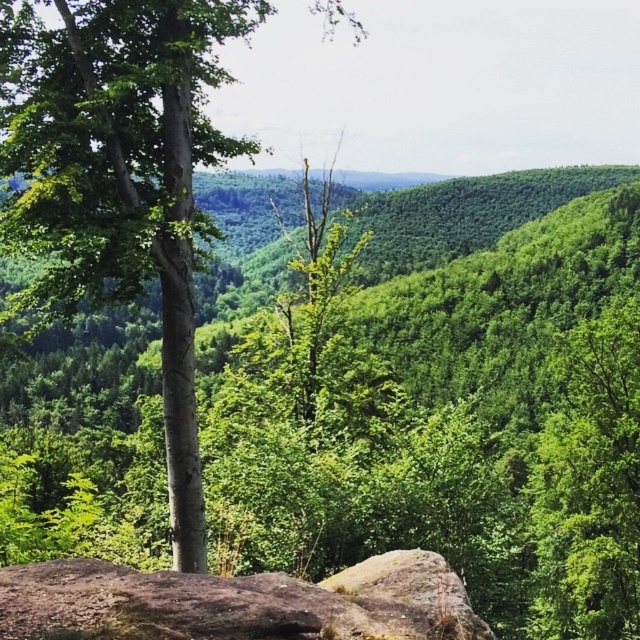
Can you confirm if green matte tree at center is positioned below brown rough rock at lower center?

No.

Which of these two, green matte tree at center or brown rough rock at lower center, stands shorter?

Standing shorter between the two is brown rough rock at lower center.

Which is behind, point (189, 426) or point (72, 605)?

Positioned behind is point (189, 426).

This screenshot has width=640, height=640. What are the coordinates of `green matte tree at center` in the screenshot? It's located at (120, 177).